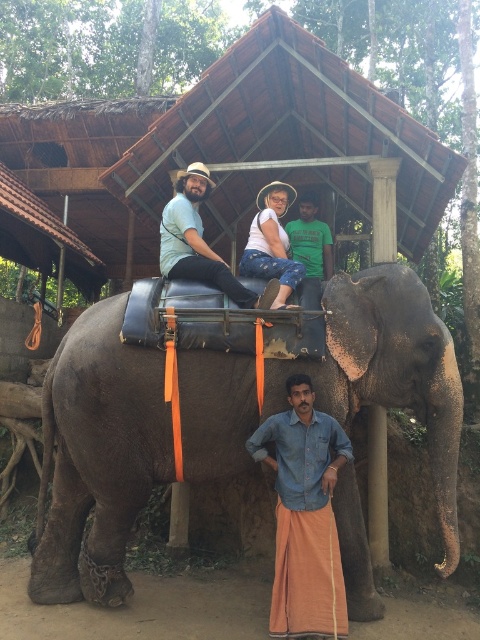
You are planning to take a photo of the brown thatched roof at upper center and the matte teal shirt at center. Which object should you focus on first if you want to capture both in a single shot without adjusting your camera settings?

The brown thatched roof at upper center is much taller than the matte teal shirt at center, so you should focus on the brown thatched roof at upper center first to ensure both are in focus.